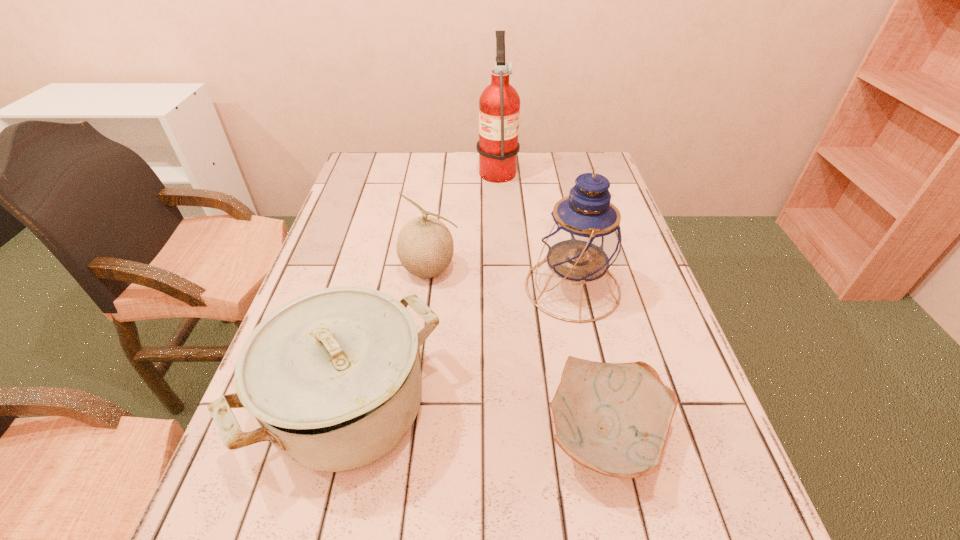
Identify the location of free space located on the front-facing side of the fourth shortest object. This screenshot has width=960, height=540. (464, 288).

Find the location of a particular element. The image size is (960, 540). blank area located on the front-facing side of the fourth shortest object is located at coordinates (496, 288).

The height and width of the screenshot is (540, 960). Identify the location of free region located 0.350m on the right of the cantaloup. (597, 270).

This screenshot has width=960, height=540. I want to click on vacant space located 0.150m on the right of the saucepan, so click(520, 407).

Identify the location of free spot located on the back of the shortest object. (577, 305).

Locate an element on the screen. object situated at the far edge is located at coordinates (499, 104).

At what (x,y) coordinates should I click in order to perform the action: click on object that is at the left edge. Please return your answer as a coordinate pair (x, y). The width and height of the screenshot is (960, 540). Looking at the image, I should click on (333, 377).

Where is `lantern that is at the right edge`? lantern that is at the right edge is located at coordinates (582, 239).

The image size is (960, 540). I want to click on pottery present at the right edge, so click(613, 418).

In the image, there is a desktop. Where is `vacant area at the far edge`? vacant area at the far edge is located at coordinates (461, 156).